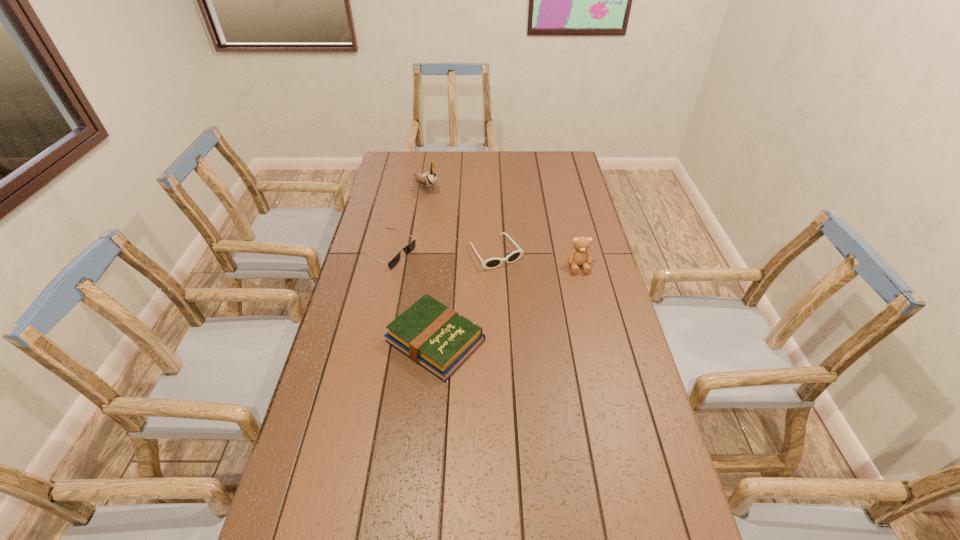
In order to click on object that is the third closest to the left sunglasses in this screenshot , I will do `click(429, 179)`.

At what (x,y) coordinates should I click in order to perform the action: click on vacant position in the image that satisfies the following two spatial constraints: 1. on the back side of the left sunglasses; 2. on the left side of the bird. Please return your answer as a coordinate pair (x, y). Looking at the image, I should click on (402, 187).